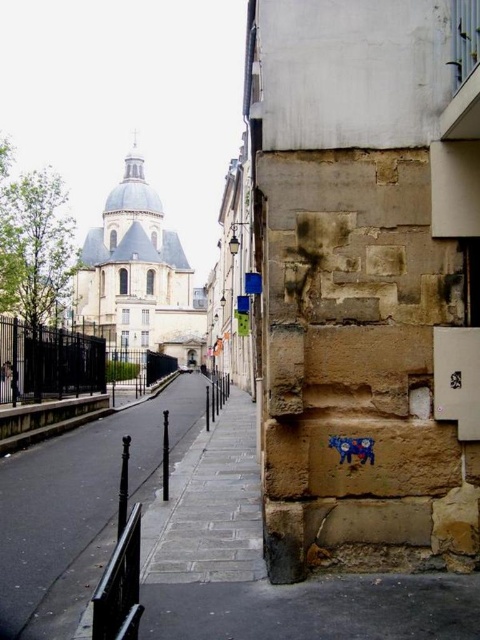
Question: Which point is farther from the camera taking this photo?

Choices:
 (A) (52, 572)
 (B) (135, 538)

Answer: (A)

Question: Can you confirm if black asphalt pavement at center is positioned to the right of black metal railing at lower left?

Choices:
 (A) no
 (B) yes

Answer: (A)

Question: Is the position of black asphalt pavement at center less distant than that of black metal railing at lower left?

Choices:
 (A) no
 (B) yes

Answer: (A)

Question: Is black asphalt pavement at center positioned in front of black metal railing at lower left?

Choices:
 (A) no
 (B) yes

Answer: (A)